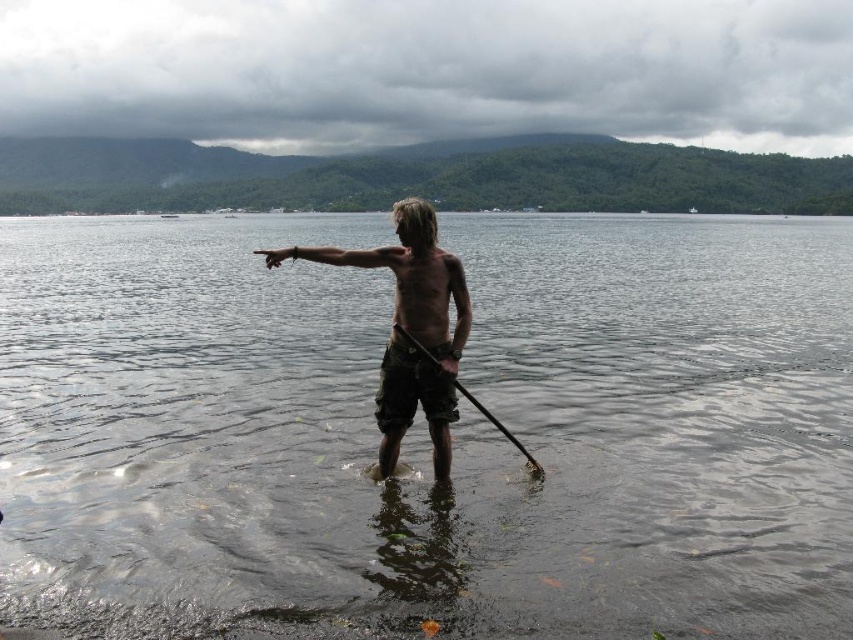
Between clear water at center and wooden smooth paddle at center, which one has more height?

clear water at center is taller.

Describe the element at coordinates (425, 432) in the screenshot. The image size is (853, 640). I see `clear water at center` at that location.

From the picture: Who is more distant from viewer, [759,288] or [416,344]?

The point [759,288] is more distant.

Find the location of `clear water at center`. clear water at center is located at coordinates (425, 432).

Who is higher up, brown camouflage shorts at center or wooden smooth paddle at center?

brown camouflage shorts at center

At what (x,y) coordinates should I click in order to perform the action: click on brown camouflage shorts at center. Please return your answer as a coordinate pair (x, y). Looking at the image, I should click on (410, 330).

Is point (428, 241) closer to camera compared to point (453, 376)?

No, it is behind (453, 376).

What are the coordinates of `brown camouflage shorts at center` in the screenshot? It's located at (410, 330).

Which is behind, point (192, 438) or point (416, 252)?

The point (192, 438) is behind.

Find the location of a particular element. clear water at center is located at coordinates (425, 432).